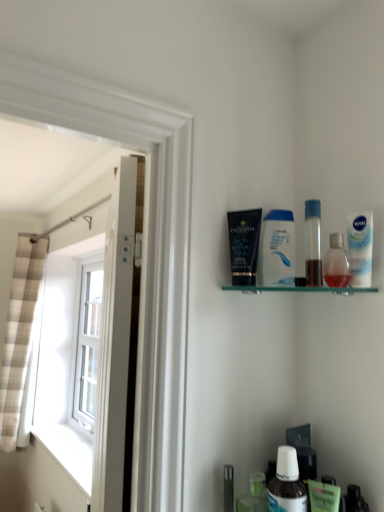
Question: Which direction should I rotate to look at translucent plastic bottle at lower center, the third toiletry viewed from the top?

Choices:
 (A) left
 (B) right

Answer: (B)

Question: Which direction should I rotate to face white plastic mouthwash at lower center, placed as the 1th mouthwash when sorted from left to right, — up or down?

Choices:
 (A) down
 (B) up

Answer: (A)

Question: Is green matte mouthwash at lower right, which is the second mouthwash in right-to-left order, with white plastic mouthwash at lower center, arranged as the 3th mouthwash when viewed from the top?

Choices:
 (A) yes
 (B) no

Answer: (A)

Question: From a real-world perspective, is green matte mouthwash at lower right, which is the first mouthwash from bottom to top, over white plastic mouthwash at lower center, the second mouthwash from the bottom?

Choices:
 (A) no
 (B) yes

Answer: (A)

Question: Can you confirm if green matte mouthwash at lower right, the fourth mouthwash viewed from the top, is smaller than white plastic mouthwash at lower center, arranged as the 3th mouthwash when viewed from the top?

Choices:
 (A) yes
 (B) no

Answer: (A)

Question: From the image's perspective, does green matte mouthwash at lower right, which is the first mouthwash from bottom to top, appear higher than white plastic mouthwash at lower center, the second mouthwash from the bottom?

Choices:
 (A) no
 (B) yes

Answer: (A)

Question: Is green matte mouthwash at lower right, which is the first mouthwash from bottom to top, looking in the opposite direction of white plastic mouthwash at lower center, the fourth mouthwash in the right-to-left sequence?

Choices:
 (A) no
 (B) yes

Answer: (A)

Question: Does green matte mouthwash at lower right, which ranks as the third mouthwash in left-to-right order, have a larger size compared to white plastic mouthwash at lower center, the fourth mouthwash in the right-to-left sequence?

Choices:
 (A) yes
 (B) no

Answer: (B)

Question: Considering the relative sizes of transparent plastic bottle at upper right, which is the fourth mouthwash from bottom to top, and matte black tube at upper center, acting as the 1th toiletry starting from the left, in the image provided, is transparent plastic bottle at upper right, which is the fourth mouthwash from bottom to top, shorter than matte black tube at upper center, acting as the 1th toiletry starting from the left,?

Choices:
 (A) yes
 (B) no

Answer: (A)

Question: Is transparent plastic bottle at upper right, positioned as the second mouthwash in left-to-right order, taller than matte black tube at upper center, which is counted as the 3th toiletry, starting from the right?

Choices:
 (A) no
 (B) yes

Answer: (A)

Question: Can you confirm if transparent plastic bottle at upper right, positioned as the 3th mouthwash in right-to-left order, is bigger than matte black tube at upper center, which is counted as the 3th toiletry, starting from the right?

Choices:
 (A) yes
 (B) no

Answer: (B)

Question: From a real-world perspective, does transparent plastic bottle at upper right, positioned as the second mouthwash in left-to-right order, stand above matte black tube at upper center, acting as the 1th toiletry starting from the top?

Choices:
 (A) yes
 (B) no

Answer: (B)

Question: From a real-world perspective, is transparent plastic bottle at upper right, positioned as the second mouthwash in left-to-right order, located beneath matte black tube at upper center, acting as the 1th toiletry starting from the top?

Choices:
 (A) no
 (B) yes

Answer: (B)

Question: Is the depth of transparent plastic bottle at upper right, positioned as the second mouthwash in left-to-right order, greater than that of matte black tube at upper center, acting as the 1th toiletry starting from the top?

Choices:
 (A) no
 (B) yes

Answer: (A)

Question: Is white glossy door at left closer to the viewer compared to matte black tube at upper center, which is counted as the 3th toiletry, starting from the right?

Choices:
 (A) no
 (B) yes

Answer: (B)